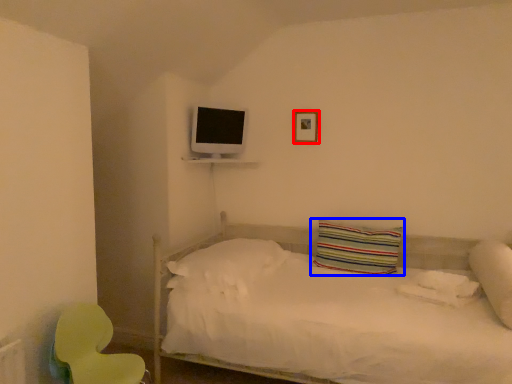
Question: Among these objects, which one is farthest to the camera, picture frame (highlighted by a red box) or pillow (highlighted by a blue box)?

Choices:
 (A) picture frame
 (B) pillow

Answer: (A)